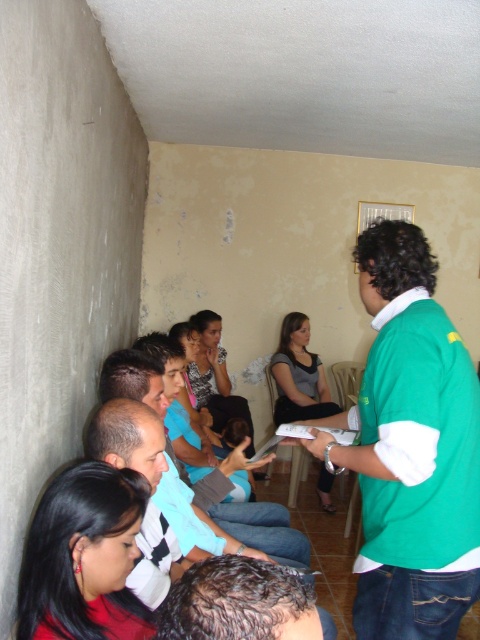
Does green fabric shirt at center have a lesser height compared to gray fabric shirt at center?

No, green fabric shirt at center is not shorter than gray fabric shirt at center.

Is green fabric shirt at center closer to the viewer compared to gray fabric shirt at center?

That is True.

Locate an element on the screen. This screenshot has height=640, width=480. green fabric shirt at center is located at coordinates (410, 449).

In order to click on green fabric shirt at center in this screenshot , I will do pyautogui.click(x=410, y=449).

Looking at this image, does black hair at lower left have a lesser height compared to light blue shirt at center?

Yes.

Is black hair at lower left thinner than light blue shirt at center?

Yes, black hair at lower left is thinner than light blue shirt at center.

Describe the element at coordinates (83, 554) in the screenshot. I see `black hair at lower left` at that location.

You are a GUI agent. You are given a task and a screenshot of the screen. Output one action in this format:
    pyautogui.click(x=<x>, y=<y>)
    Task: Click on the black hair at lower left
    
    Given the screenshot: What is the action you would take?
    pyautogui.click(x=83, y=554)

The width and height of the screenshot is (480, 640). In order to click on green fabric shirt at center in this screenshot , I will do `click(410, 449)`.

Measure the distance from green fabric shirt at center to dark brown hair at center.

green fabric shirt at center and dark brown hair at center are 74.85 centimeters apart.

Between point (470, 509) and point (287, 593), which one is positioned in front?

Point (287, 593) is in front.

Find the location of a particular element. The image size is (480, 640). green fabric shirt at center is located at coordinates (410, 449).